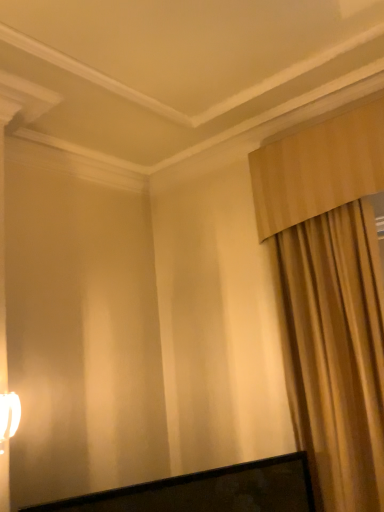
Question: Is beige fabric curtain at right in front of white glossy table lamp at left?

Choices:
 (A) no
 (B) yes

Answer: (A)

Question: Does beige fabric curtain at right contain white glossy table lamp at left?

Choices:
 (A) no
 (B) yes

Answer: (A)

Question: From the image's perspective, is beige fabric curtain at right on top of white glossy table lamp at left?

Choices:
 (A) yes
 (B) no

Answer: (A)

Question: Does beige fabric curtain at right turn towards white glossy table lamp at left?

Choices:
 (A) yes
 (B) no

Answer: (B)

Question: Would you say beige fabric curtain at right is outside white glossy table lamp at left?

Choices:
 (A) no
 (B) yes

Answer: (B)

Question: Is beige fabric curtain at right shorter than white glossy table lamp at left?

Choices:
 (A) no
 (B) yes

Answer: (A)

Question: Are white glossy table lamp at left and beige fabric curtain at right far apart?

Choices:
 (A) no
 (B) yes

Answer: (B)

Question: Can you confirm if white glossy table lamp at left is smaller than beige fabric curtain at right?

Choices:
 (A) yes
 (B) no

Answer: (A)

Question: Is white glossy table lamp at left aimed at beige fabric curtain at right?

Choices:
 (A) yes
 (B) no

Answer: (B)

Question: Does white glossy table lamp at left lie in front of beige fabric curtain at right?

Choices:
 (A) yes
 (B) no

Answer: (A)

Question: Considering the relative positions of white glossy table lamp at left and beige fabric curtain at right in the image provided, is white glossy table lamp at left to the left of beige fabric curtain at right from the viewer's perspective?

Choices:
 (A) yes
 (B) no

Answer: (A)

Question: Is white glossy table lamp at left further to the viewer compared to beige fabric curtain at right?

Choices:
 (A) no
 (B) yes

Answer: (A)

Question: In terms of size, does beige fabric curtain at right appear bigger or smaller than white glossy table lamp at left?

Choices:
 (A) big
 (B) small

Answer: (A)